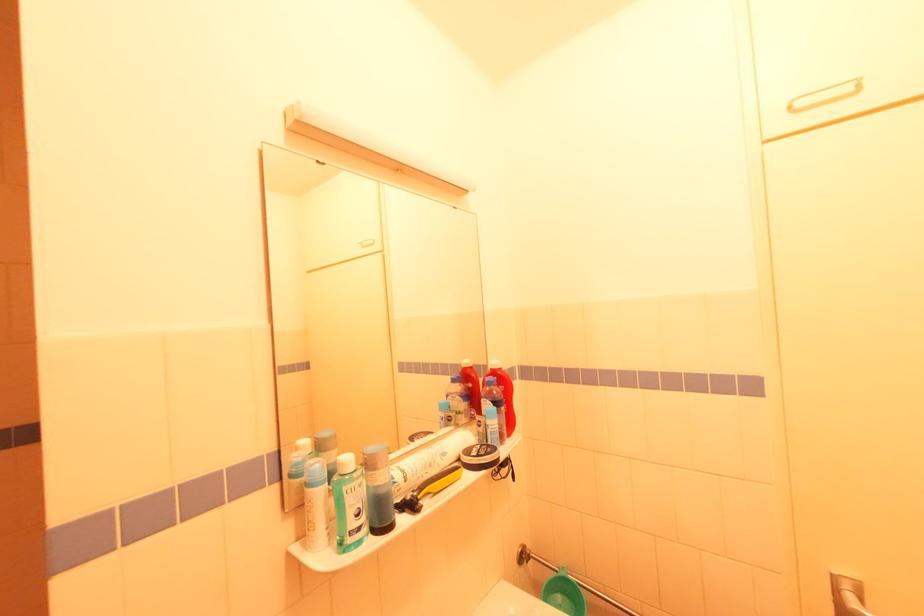
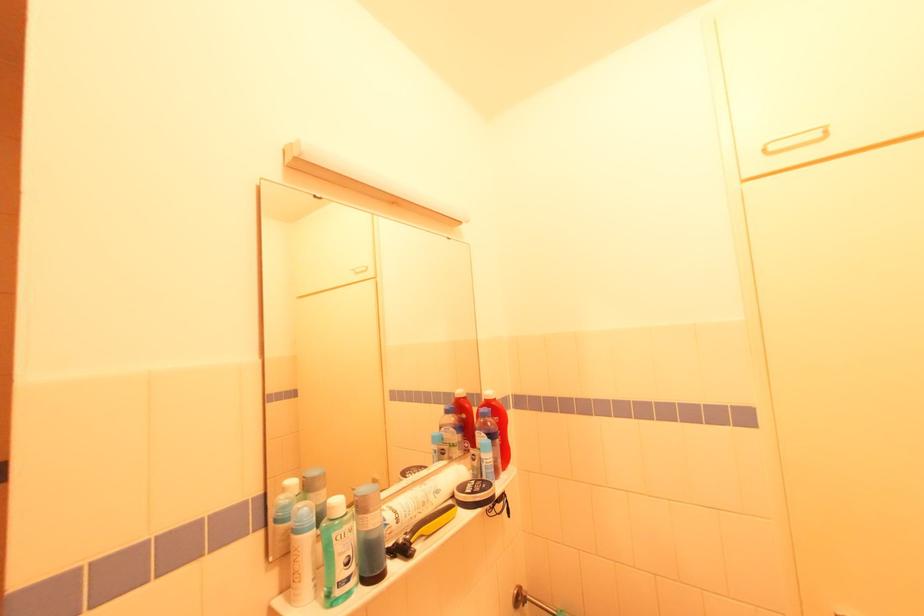
In the second image, find the point that corresponds to [799,105] in the first image.

(773, 148)